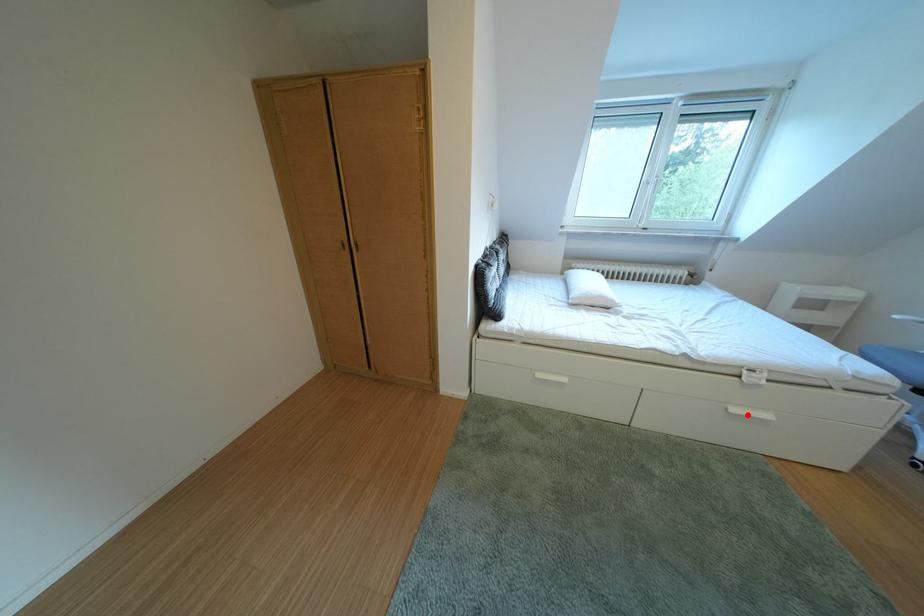
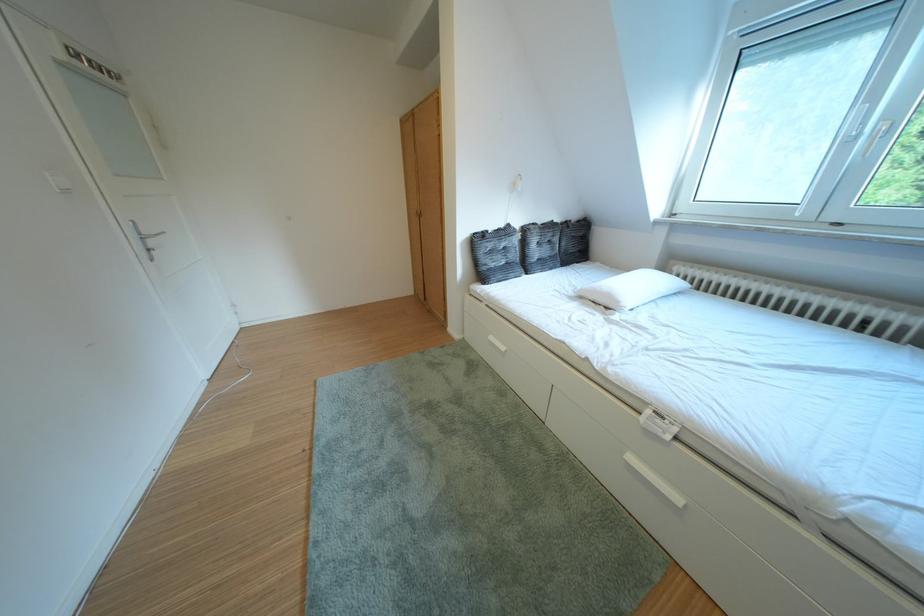
The point at the highlighted location is marked in the first image. Where is the corresponding point in the second image?

(646, 464)